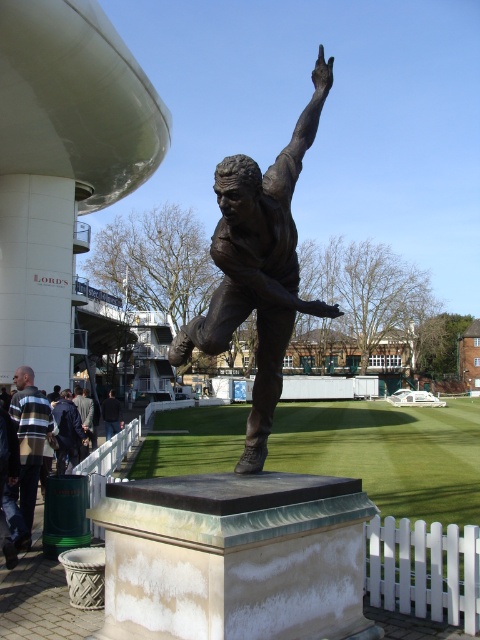
Question: Considering the relative positions of striped sweater at lower left and dark blue jacket at lower left in the image provided, where is striped sweater at lower left located with respect to dark blue jacket at lower left?

Choices:
 (A) below
 (B) above

Answer: (B)

Question: Estimate the real-world distances between objects in this image. Which object is farther from the dark brown leather jacket at lower left?

Choices:
 (A) dark brown statue at center
 (B) bronze statue at center
 (C) striped sweater at lower left

Answer: (B)

Question: Does bronze statue at center come behind striped sweater at lower left?

Choices:
 (A) no
 (B) yes

Answer: (A)

Question: Can you confirm if dark blue jacket at lower left is positioned to the right of dark brown leather jacket at lower left?

Choices:
 (A) yes
 (B) no

Answer: (A)

Question: Among these objects, which one is farthest from the camera?

Choices:
 (A) dark brown statue at center
 (B) dark blue jacket at lower left
 (C) dark brown leather jacket at lower left
 (D) striped sweater at lower left

Answer: (A)

Question: Which object appears closest to the camera in this image?

Choices:
 (A) dark brown statue at center
 (B) striped sweater at lower left
 (C) dark blue jacket at lower left
 (D) dark brown leather jacket at lower left

Answer: (B)